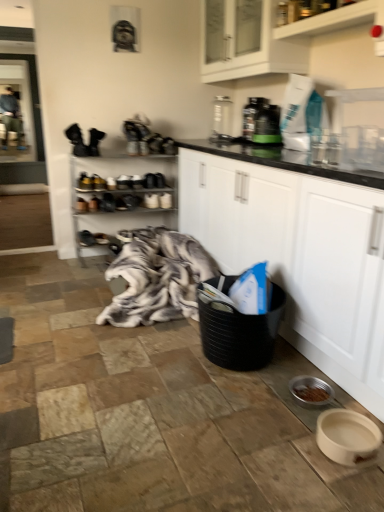
Question: Would you say metallic silver shoe rack at center, which is the first shelf from back to front, is to the left or to the right of white glossy cabinet at upper center, positioned as the first cabinetry in top-to-bottom order, in the picture?

Choices:
 (A) left
 (B) right

Answer: (A)

Question: Is point (127, 155) closer or farther from the camera than point (301, 54)?

Choices:
 (A) closer
 (B) farther

Answer: (B)

Question: Estimate the real-world distances between objects in this image. Which object is closer to the clear glass screen door at upper left?

Choices:
 (A) white glossy shelf at upper center, the first shelf viewed from the top
 (B) black woven laundry basket at lower center
 (C) metallic silver shoe rack at center, marked as the 2th shelf in a right-to-left arrangement
 (D) green plastic bottle at upper center, the 2th appliance viewed from the back
 (E) white glossy cabinet at upper center, the second cabinetry when ordered from bottom to top

Answer: (C)

Question: Which object is the farthest from the clear glass screen door at upper left?

Choices:
 (A) green plastic bottle at upper center, the 2th appliance viewed from the back
 (B) white glossy cabinet at upper center, positioned as the first cabinetry in top-to-bottom order
 (C) metallic silver shoe rack at center, marked as the 2th shelf in a right-to-left arrangement
 (D) white matte cabinet at center, arranged as the second cabinetry when viewed from the top
 (E) metallic gray coffee maker at upper center, arranged as the 2th appliance when viewed from the right

Answer: (D)